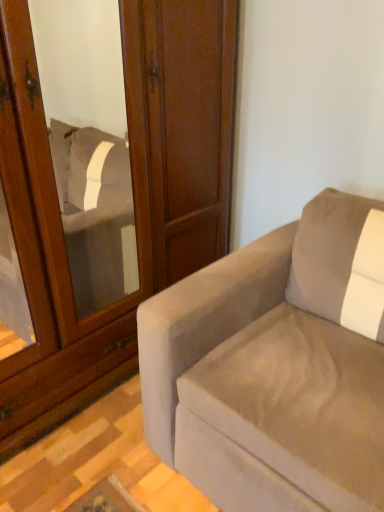
Question: Considering the relative sizes of suede-like beige couch at right and matte wood screen door at upper left in the image provided, is suede-like beige couch at right thinner than matte wood screen door at upper left?

Choices:
 (A) yes
 (B) no

Answer: (B)

Question: Can you confirm if suede-like beige couch at right is taller than matte wood screen door at upper left?

Choices:
 (A) no
 (B) yes

Answer: (A)

Question: Could matte wood screen door at upper left be considered to be inside suede-like beige couch at right?

Choices:
 (A) no
 (B) yes

Answer: (A)

Question: Is suede-like beige couch at right turned away from matte wood screen door at upper left?

Choices:
 (A) yes
 (B) no

Answer: (B)

Question: Is suede-like beige couch at right at the left side of matte wood screen door at upper left?

Choices:
 (A) no
 (B) yes

Answer: (A)

Question: Considering the relative positions of suede-like beige couch at right and matte wood screen door at upper left in the image provided, is suede-like beige couch at right in front of matte wood screen door at upper left?

Choices:
 (A) yes
 (B) no

Answer: (A)

Question: From a real-world perspective, is matte wood screen door at upper left below suede-like beige couch at right?

Choices:
 (A) no
 (B) yes

Answer: (A)

Question: From a real-world perspective, is matte wood screen door at upper left positioned over suede-like beige couch at right based on gravity?

Choices:
 (A) no
 (B) yes

Answer: (B)

Question: Can you confirm if matte wood screen door at upper left is bigger than suede-like beige couch at right?

Choices:
 (A) yes
 (B) no

Answer: (A)

Question: Does matte wood screen door at upper left have a lesser height compared to suede-like beige couch at right?

Choices:
 (A) yes
 (B) no

Answer: (B)

Question: From the image's perspective, is matte wood screen door at upper left above suede-like beige couch at right?

Choices:
 (A) yes
 (B) no

Answer: (A)

Question: Considering the relative sizes of matte wood screen door at upper left and suede-like beige couch at right in the image provided, is matte wood screen door at upper left taller than suede-like beige couch at right?

Choices:
 (A) no
 (B) yes

Answer: (B)

Question: Is suede-like beige couch at right wider or thinner than matte wood screen door at upper left?

Choices:
 (A) thin
 (B) wide

Answer: (B)